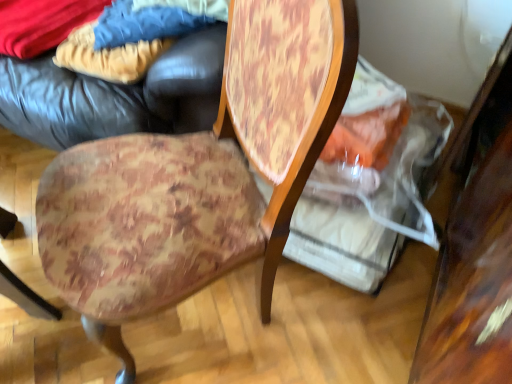
Question: Considering the relative positions of velvety blue blanket at upper left, which appears as the third fabric when viewed from the right, and blue denim jeans at upper left, the 3th fabric positioned from the left, in the image provided, is velvety blue blanket at upper left, which appears as the third fabric when viewed from the right, in front of blue denim jeans at upper left, the 3th fabric positioned from the left,?

Choices:
 (A) no
 (B) yes

Answer: (A)

Question: Can you confirm if velvety blue blanket at upper left, the first fabric from the left, is bigger than blue denim jeans at upper left, the first fabric positioned from the right?

Choices:
 (A) yes
 (B) no

Answer: (A)

Question: From a real-world perspective, is velvety blue blanket at upper left, the first fabric from the left, positioned over blue denim jeans at upper left, the 3th fabric positioned from the left, based on gravity?

Choices:
 (A) no
 (B) yes

Answer: (A)

Question: Is velvety blue blanket at upper left, the first fabric from the left, to the left of blue denim jeans at upper left, the 3th fabric positioned from the left, from the viewer's perspective?

Choices:
 (A) yes
 (B) no

Answer: (A)

Question: Does velvety blue blanket at upper left, the first fabric from the left, turn towards blue denim jeans at upper left, the first fabric positioned from the right?

Choices:
 (A) yes
 (B) no

Answer: (B)

Question: From the image's perspective, is leather bean bag at upper left positioned above or below velvety blue blanket at upper left, which appears as the third fabric when viewed from the right?

Choices:
 (A) above
 (B) below

Answer: (B)

Question: From their relative heights in the image, would you say leather bean bag at upper left is taller or shorter than velvety blue blanket at upper left, the first fabric from the left?

Choices:
 (A) tall
 (B) short

Answer: (A)

Question: Does point (32, 125) appear closer or farther from the camera than point (12, 33)?

Choices:
 (A) farther
 (B) closer

Answer: (B)

Question: Is leather bean bag at upper left to the left or to the right of velvety blue blanket at upper left, which appears as the third fabric when viewed from the right, in the image?

Choices:
 (A) right
 (B) left

Answer: (A)

Question: From the image's perspective, relative to leather bean bag at upper left, is blue denim jeans at upper left, the first fabric positioned from the right, above or below?

Choices:
 (A) above
 (B) below

Answer: (A)

Question: Based on their positions, is blue denim jeans at upper left, the first fabric positioned from the right, located to the left or right of leather bean bag at upper left?

Choices:
 (A) left
 (B) right

Answer: (B)

Question: From a real-world perspective, is blue denim jeans at upper left, the 3th fabric positioned from the left, positioned above or below leather bean bag at upper left?

Choices:
 (A) below
 (B) above

Answer: (B)

Question: Based on their sizes in the image, would you say blue denim jeans at upper left, the 3th fabric positioned from the left, is bigger or smaller than leather bean bag at upper left?

Choices:
 (A) small
 (B) big

Answer: (A)

Question: Considering their positions, is velvet-like beige pants at upper left, the 2th fabric when ordered from right to left, located in front of or behind wooden table at right?

Choices:
 (A) front
 (B) behind

Answer: (B)

Question: Is velvet-like beige pants at upper left, the 2th fabric when ordered from right to left, spatially inside wooden table at right, or outside of it?

Choices:
 (A) outside
 (B) inside

Answer: (A)